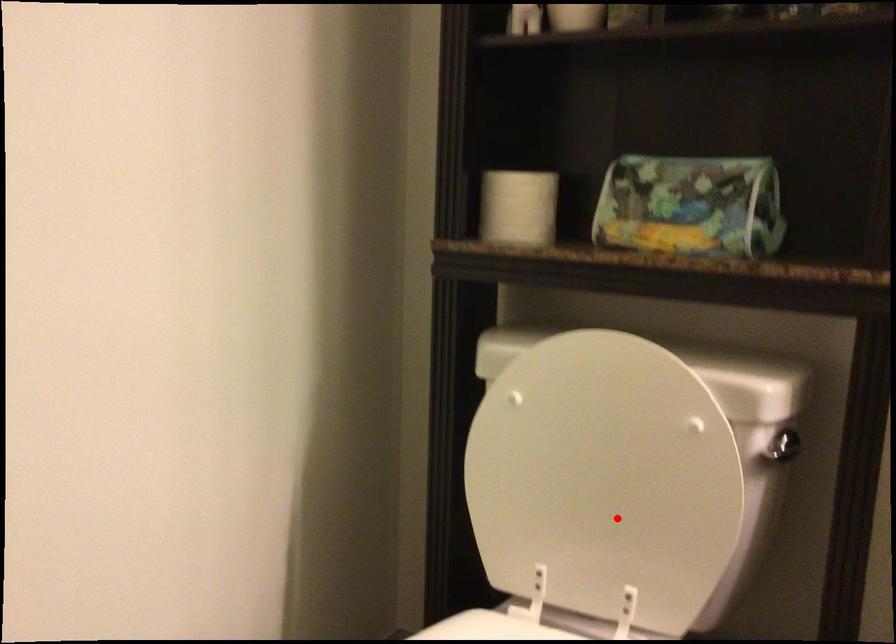
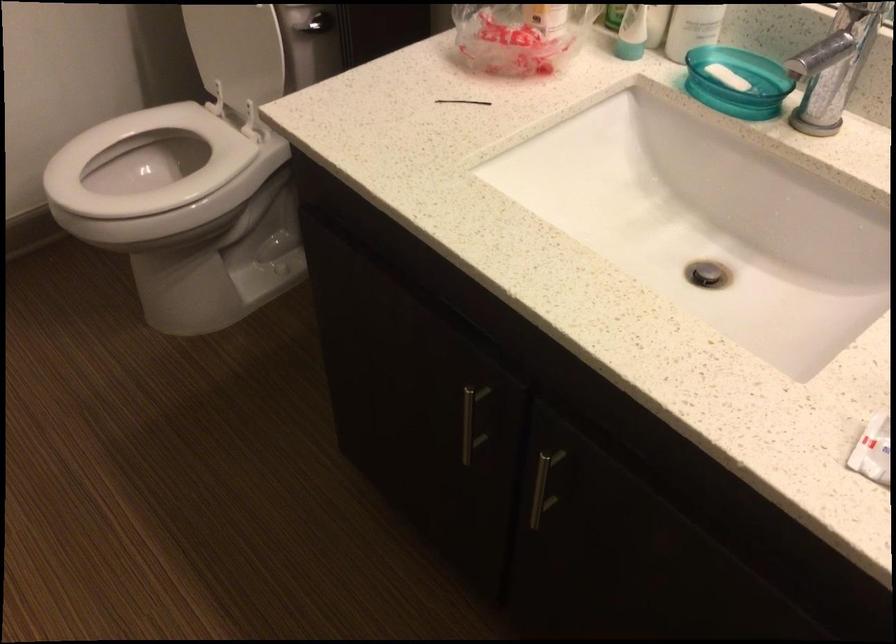
Where in the second image is the point corresponding to the highlighted location from the first image?

(237, 51)